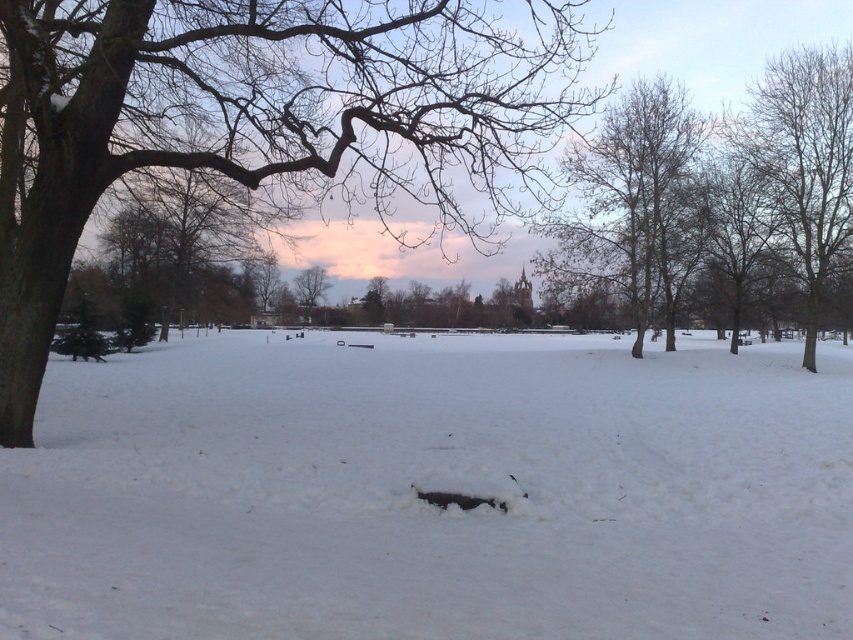
You are a hiker trying to cross the area between the white fluffy snow at center and the smooth bark tree at left. Which direction should you head to move from the tree towards the snow?

To move from the smooth bark tree at left to the white fluffy snow at center, you should head to the right since the snow is located to the right of the tree.

You are an observer standing in the winter scene. You see the white fluffy snow at center and the smooth bark tree at left. Which object is taller?

The smooth bark tree at left is taller than the white fluffy snow at center.